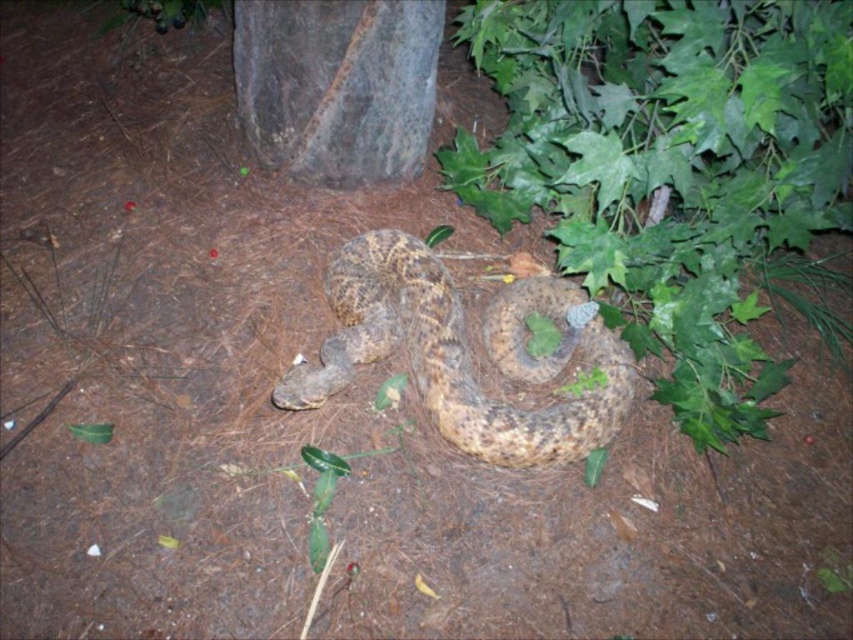
You are standing in the forest and see the green leafy plant at center. Can you determine its exact position relative to the tree trunk visible in the upper left corner?

The green leafy plant at center is located at point (671, 164), so it is positioned to the right and slightly below the tree trunk in the upper left corner.